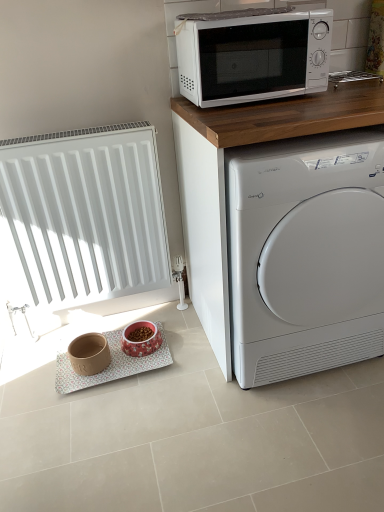
Question: Should I look upward or downward to see pink glossy bowl at lower center, the 2th appliance viewed from the left?

Choices:
 (A) down
 (B) up

Answer: (A)

Question: Considering the relative positions of matte brown bowl at lower left, marked as the 2th appliance in a right-to-left arrangement, and white glossy microwave at upper center in the image provided, is matte brown bowl at lower left, marked as the 2th appliance in a right-to-left arrangement, to the left of white glossy microwave at upper center from the viewer's perspective?

Choices:
 (A) no
 (B) yes

Answer: (B)

Question: From the image's perspective, is matte brown bowl at lower left, the 1th appliance when ordered from left to right, beneath white glossy microwave at upper center?

Choices:
 (A) yes
 (B) no

Answer: (A)

Question: Considering the relative sizes of matte brown bowl at lower left, the 1th appliance when ordered from left to right, and white glossy microwave at upper center in the image provided, is matte brown bowl at lower left, the 1th appliance when ordered from left to right, smaller than white glossy microwave at upper center?

Choices:
 (A) no
 (B) yes

Answer: (B)

Question: Is matte brown bowl at lower left, the 1th appliance when ordered from left to right, facing away from white glossy microwave at upper center?

Choices:
 (A) no
 (B) yes

Answer: (A)

Question: Is matte brown bowl at lower left, marked as the 2th appliance in a right-to-left arrangement, positioned before white glossy microwave at upper center?

Choices:
 (A) yes
 (B) no

Answer: (B)

Question: Can you confirm if matte brown bowl at lower left, marked as the 2th appliance in a right-to-left arrangement, is shorter than white glossy microwave at upper center?

Choices:
 (A) no
 (B) yes

Answer: (B)

Question: Is white glossy washing machine at right thinner than white glossy microwave at upper center?

Choices:
 (A) yes
 (B) no

Answer: (B)

Question: Is white glossy washing machine at right wider than white glossy microwave at upper center?

Choices:
 (A) yes
 (B) no

Answer: (A)

Question: Does white glossy washing machine at right contain white glossy microwave at upper center?

Choices:
 (A) no
 (B) yes

Answer: (A)

Question: Is white glossy washing machine at right not within white glossy microwave at upper center?

Choices:
 (A) yes
 (B) no

Answer: (A)

Question: From a real-world perspective, is white glossy washing machine at right beneath white glossy microwave at upper center?

Choices:
 (A) yes
 (B) no

Answer: (A)

Question: Can you confirm if white glossy washing machine at right is shorter than white glossy microwave at upper center?

Choices:
 (A) no
 (B) yes

Answer: (A)

Question: Can you confirm if pink glossy bowl at lower center, the 2th appliance viewed from the left, is taller than white matte radiator at left?

Choices:
 (A) no
 (B) yes

Answer: (A)